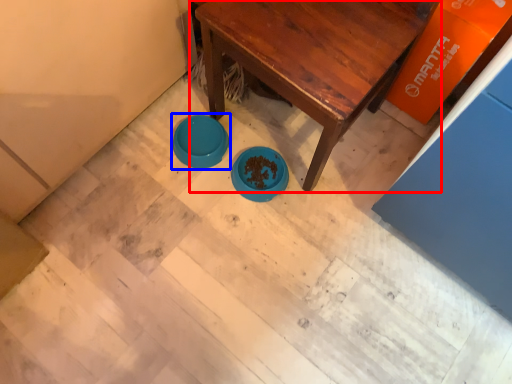
Question: Which object is further to the camera taking this photo, table (highlighted by a red box) or basin (highlighted by a blue box)?

Choices:
 (A) table
 (B) basin

Answer: (B)